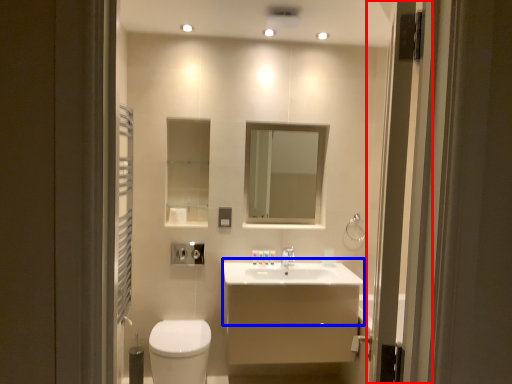
Question: Which object appears farthest to the camera in this image, screen door (highlighted by a red box) or counter top (highlighted by a blue box)?

Choices:
 (A) screen door
 (B) counter top

Answer: (B)